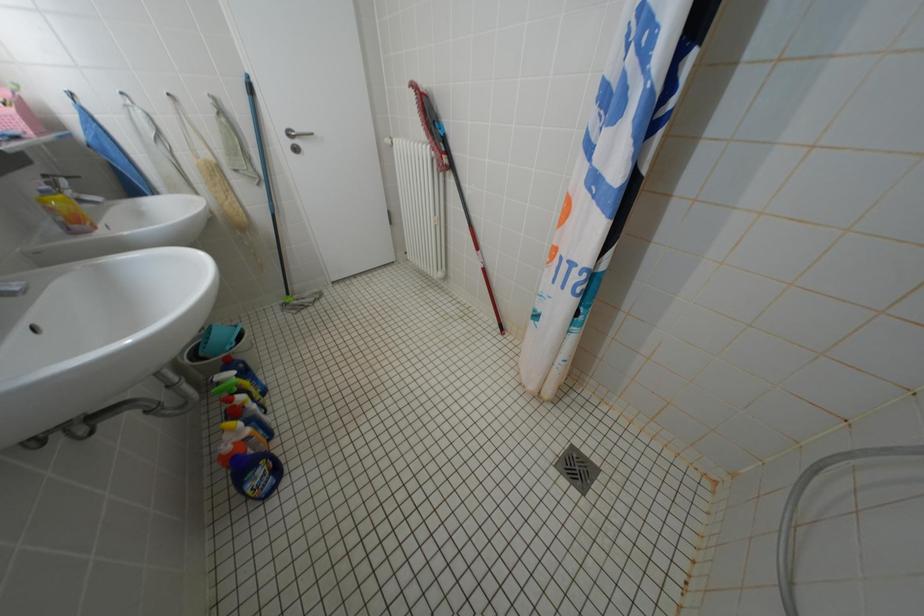
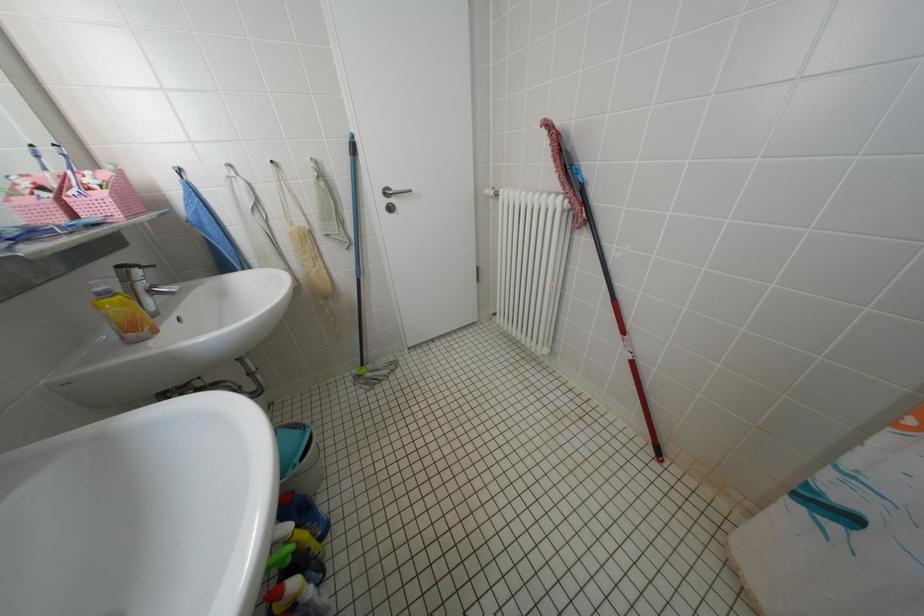
Question: Based on the continuous images, in which direction is the camera rotating? Reply with the corresponding letter.

Choices:
 (A) Left
 (B) Right
 (C) Up
 (D) Down

Answer: (A)